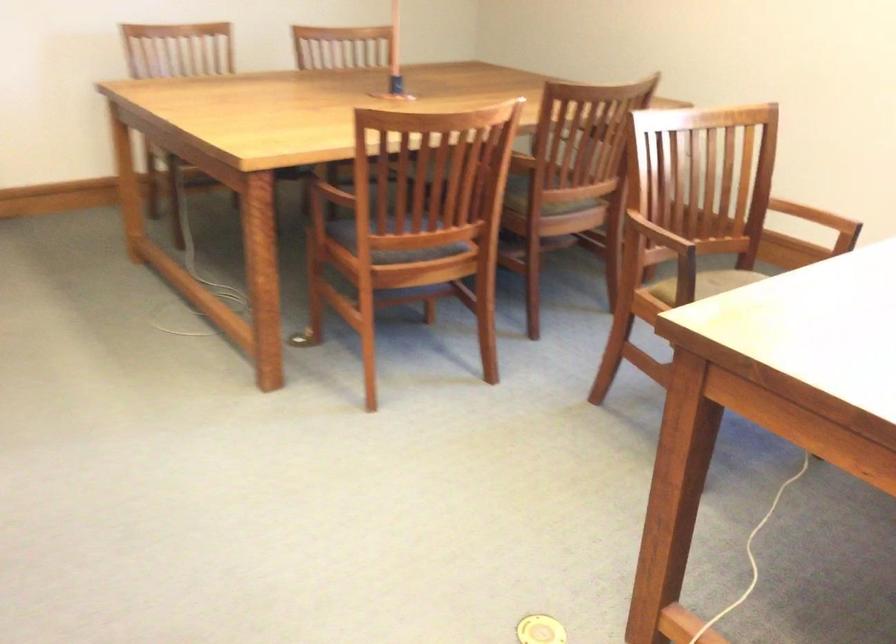
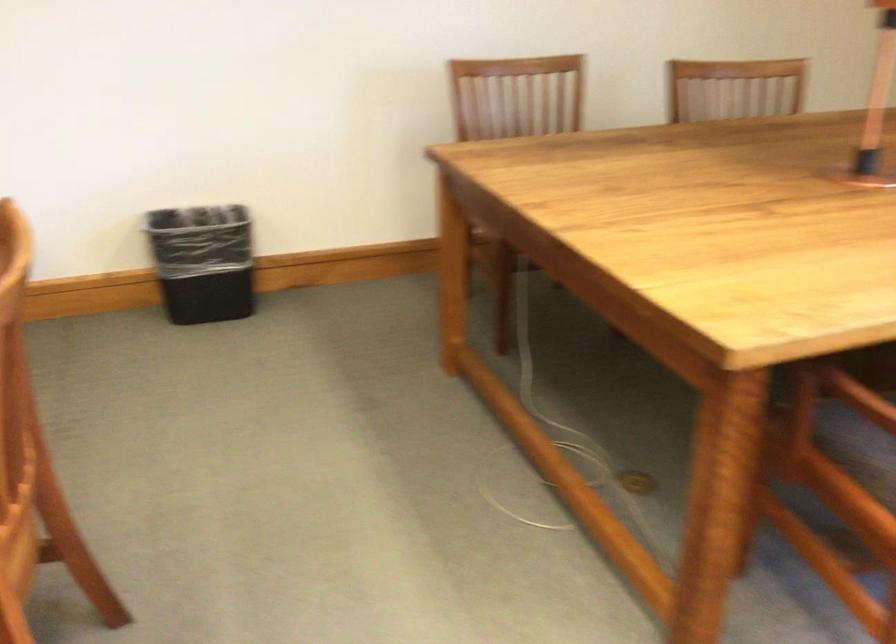
Which direction would the cameraman need to move to produce the second image?

The movement direction of the cameraman is left, forward.